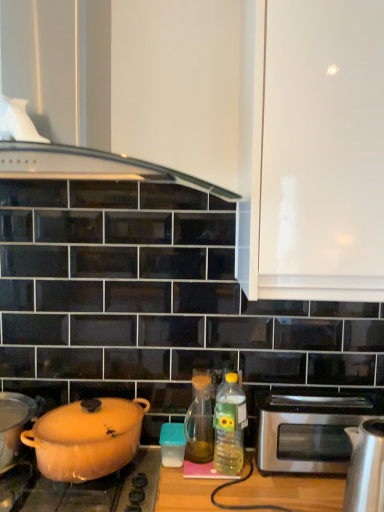
Question: In which direction should I rotate to look at translucent plastic bottle at center, the 1th bottle when ordered from right to left?

Choices:
 (A) right
 (B) left

Answer: (A)

Question: Considering the relative sizes of matte orange pot at lower left and translucent plastic bottle at center, the 1th bottle when ordered from right to left, in the image provided, is matte orange pot at lower left smaller than translucent plastic bottle at center, the 1th bottle when ordered from right to left,?

Choices:
 (A) no
 (B) yes

Answer: (A)

Question: From a real-world perspective, does matte orange pot at lower left stand above translucent plastic bottle at center, acting as the 2th bottle starting from the left?

Choices:
 (A) no
 (B) yes

Answer: (A)

Question: Does matte orange pot at lower left appear on the left side of translucent plastic bottle at center, acting as the 2th bottle starting from the left?

Choices:
 (A) yes
 (B) no

Answer: (A)

Question: Is matte orange pot at lower left positioned with its back to translucent plastic bottle at center, acting as the 2th bottle starting from the left?

Choices:
 (A) no
 (B) yes

Answer: (A)

Question: Is matte orange pot at lower left next to translucent plastic bottle at center, the 1th bottle when ordered from right to left, and touching it?

Choices:
 (A) no
 (B) yes

Answer: (A)

Question: Can you confirm if matte orange pot at lower left is thinner than translucent plastic bottle at center, acting as the 2th bottle starting from the left?

Choices:
 (A) yes
 (B) no

Answer: (B)

Question: Is stainless steel toaster at right to the right of translucent amber glass at center, which is counted as the first bottle, starting from the left, from the viewer's perspective?

Choices:
 (A) no
 (B) yes

Answer: (B)

Question: Is the depth of stainless steel toaster at right greater than that of translucent amber glass at center, which is counted as the first bottle, starting from the left?

Choices:
 (A) no
 (B) yes

Answer: (A)

Question: Is stainless steel toaster at right positioned far away from translucent amber glass at center, which is counted as the first bottle, starting from the left?

Choices:
 (A) no
 (B) yes

Answer: (A)

Question: Is stainless steel toaster at right next to translucent amber glass at center, which is counted as the first bottle, starting from the left, and touching it?

Choices:
 (A) no
 (B) yes

Answer: (A)

Question: Does stainless steel toaster at right contain translucent amber glass at center, the 2th bottle when ordered from right to left?

Choices:
 (A) no
 (B) yes

Answer: (A)

Question: From a real-world perspective, is stainless steel toaster at right below translucent amber glass at center, which is counted as the first bottle, starting from the left?

Choices:
 (A) no
 (B) yes

Answer: (B)

Question: Considering the relative sizes of matte orange pot at left, which appears as the 1th kitchen appliance when viewed from the left, and satin silver kettle at right, which appears as the 2th kitchen appliance when ordered from the bottom, in the image provided, is matte orange pot at left, which appears as the 1th kitchen appliance when viewed from the left, taller than satin silver kettle at right, which appears as the 2th kitchen appliance when ordered from the bottom,?

Choices:
 (A) no
 (B) yes

Answer: (A)